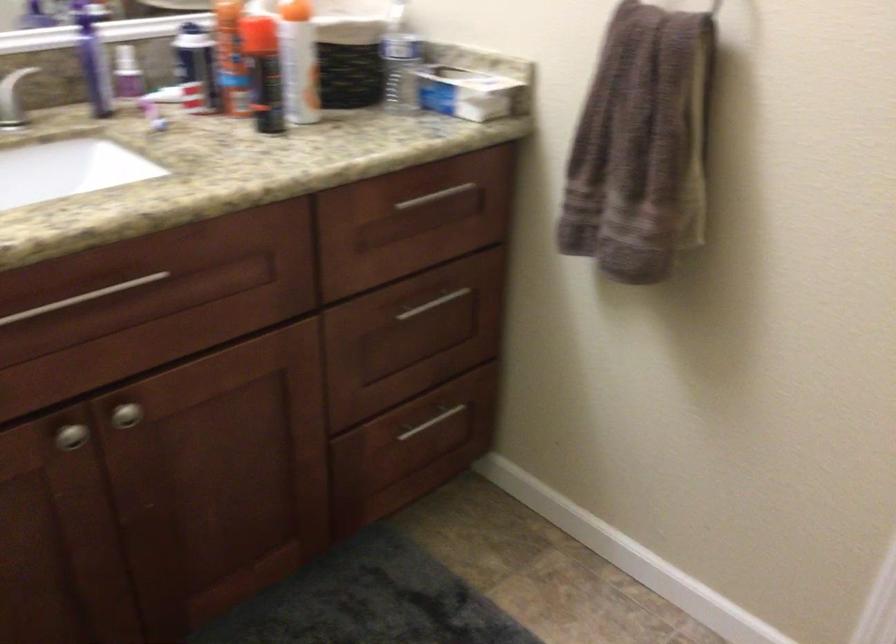
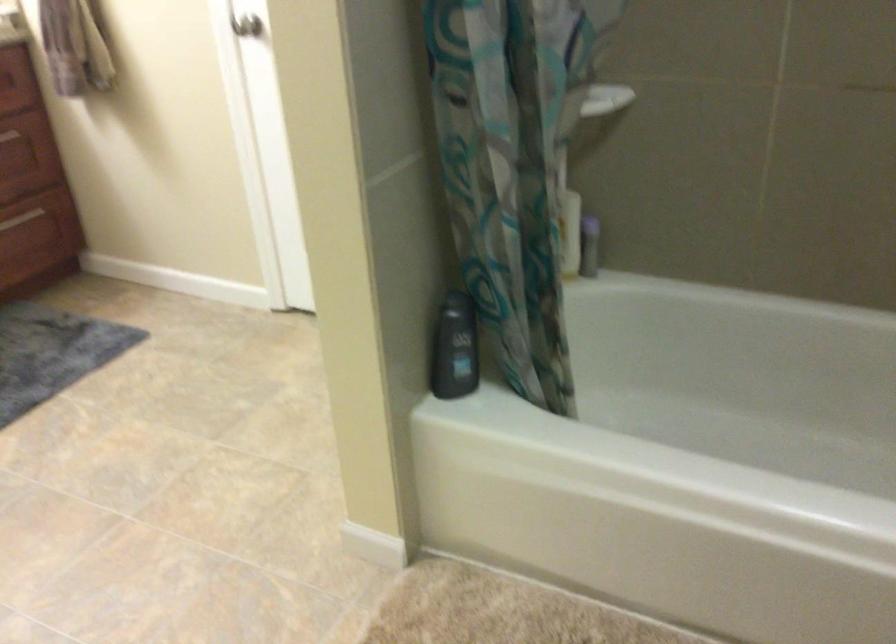
The images are taken continuously from a first-person perspective. In which direction are you moving?

The cameraman moved toward right, backward.